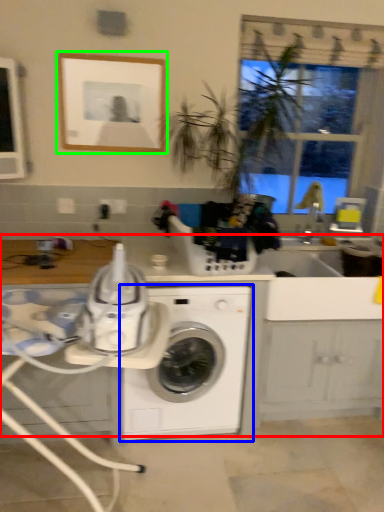
Question: Which object is the closest to the counter top (highlighted by a red box)? Choose among these: washing machine (highlighted by a blue box) or picture frame (highlighted by a green box).

Choices:
 (A) washing machine
 (B) picture frame

Answer: (A)